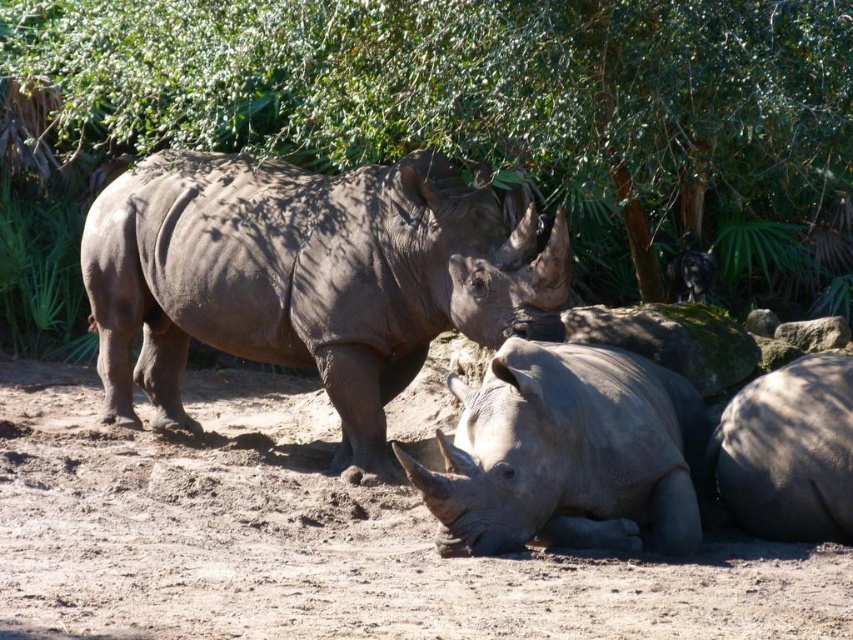
Question: Which point is closer to the camera taking this photo?

Choices:
 (A) (152, 548)
 (B) (721, 16)
 (C) (552, 364)

Answer: (A)

Question: Is dull brown dirt at center above gray matte rhinoceros at lower right?

Choices:
 (A) no
 (B) yes

Answer: (A)

Question: Is green leafy tree at upper center closer to the viewer compared to gray matte rhinoceros at center?

Choices:
 (A) yes
 (B) no

Answer: (B)

Question: Which object appears farthest from the camera in this image?

Choices:
 (A) dull brown dirt at center
 (B) gray matte rhinoceros at lower right

Answer: (B)

Question: Does green leafy tree at upper center appear on the left side of dull brown dirt at center?

Choices:
 (A) no
 (B) yes

Answer: (A)

Question: Which point is closer to the camera taking this photo?

Choices:
 (A) (544, 28)
 (B) (312, 240)
 (C) (421, 538)
 (D) (515, 429)

Answer: (D)